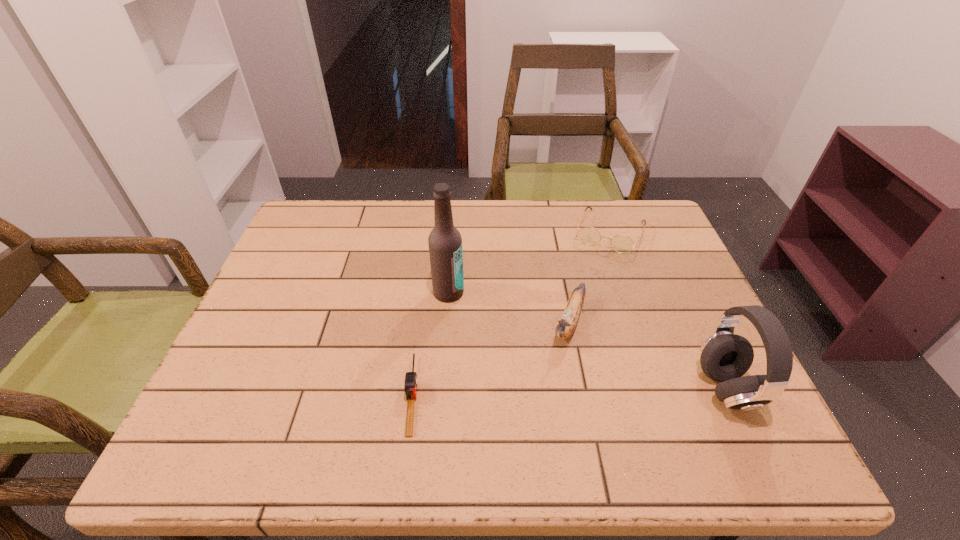
In order to click on vacant space on the desktop that is between the tape measure and the headset and is positioned on the side of the second object from left to right with the label in this screenshot , I will do `click(544, 392)`.

Find the location of a particular element. This screenshot has width=960, height=540. vacant space on the desktop that is between the tape measure and the headset and is positioned on the lenses of the fourth tallest object is located at coordinates (547, 392).

Locate an element on the screen. Image resolution: width=960 pixels, height=540 pixels. vacant space on the desktop that is between the shortest object and the headset and is positioned on the peel of the third shortest object is located at coordinates (537, 392).